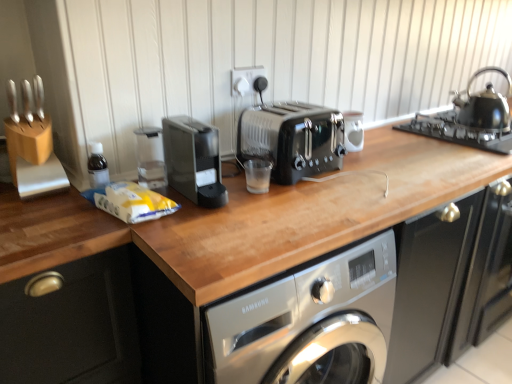
Question: Is black glass gas stove at upper right taller or shorter than shiny black kettle at upper right?

Choices:
 (A) short
 (B) tall

Answer: (A)

Question: From a real-world perspective, is black glass gas stove at upper right positioned above or below shiny black kettle at upper right?

Choices:
 (A) above
 (B) below

Answer: (B)

Question: Which is farther from the black glass gas stove at upper right?

Choices:
 (A) white glossy coffee cup at center
 (B) white plastic socket at upper center
 (C) black plastic coffee machine at center
 (D) wooden knife block at upper left
 (E) matte black knob at upper center

Answer: (D)

Question: Considering the real-world distances, which object is closest to the wooden knife block at upper left?

Choices:
 (A) matte black knob at upper center
 (B) wooden at center
 (C) white glossy coffee cup at center
 (D) white plastic socket at upper center
 (E) black metallic toaster at center

Answer: (D)